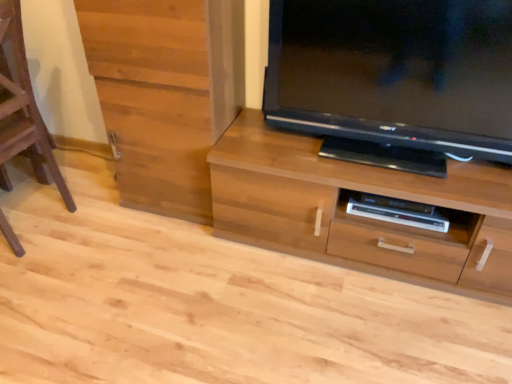
Locate an element on the screen. free space above wooden chest of drawers at center (from a real-world perspective) is located at coordinates (367, 160).